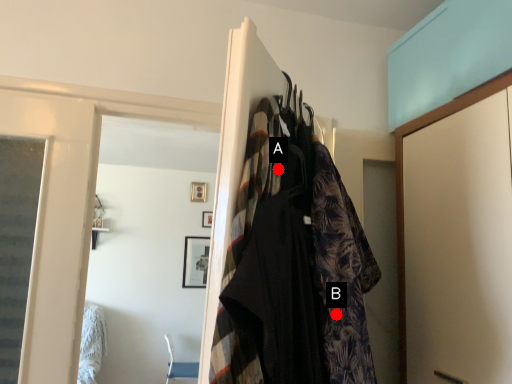
Question: Two points are circled on the image, labeled by A and B beside each circle. Which point is closer to the camera taking this photo?

Choices:
 (A) A is closer
 (B) B is closer

Answer: (A)